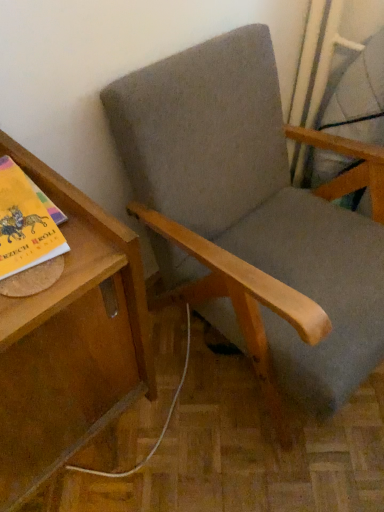
Question: From the image's perspective, is wooden table at left located above textured gray fabric chair at center?

Choices:
 (A) yes
 (B) no

Answer: (B)

Question: Is wooden table at left at the left side of textured gray fabric chair at center?

Choices:
 (A) no
 (B) yes

Answer: (B)

Question: Considering the relative sizes of wooden table at left and textured gray fabric chair at center in the image provided, is wooden table at left smaller than textured gray fabric chair at center?

Choices:
 (A) no
 (B) yes

Answer: (B)

Question: Can textured gray fabric chair at center be found inside wooden table at left?

Choices:
 (A) yes
 (B) no

Answer: (B)

Question: Does wooden table at left come in front of textured gray fabric chair at center?

Choices:
 (A) no
 (B) yes

Answer: (B)

Question: From a real-world perspective, is wooden table at left below textured gray fabric chair at center?

Choices:
 (A) yes
 (B) no

Answer: (A)

Question: Does matte gray swivel chair at upper right appear on the right side of textured gray fabric chair at center?

Choices:
 (A) no
 (B) yes

Answer: (B)

Question: Is matte gray swivel chair at upper right positioned behind textured gray fabric chair at center?

Choices:
 (A) yes
 (B) no

Answer: (A)

Question: Is matte gray swivel chair at upper right outside of textured gray fabric chair at center?

Choices:
 (A) yes
 (B) no

Answer: (A)

Question: From a real-world perspective, is matte gray swivel chair at upper right on top of textured gray fabric chair at center?

Choices:
 (A) yes
 (B) no

Answer: (A)

Question: Is matte gray swivel chair at upper right facing towards textured gray fabric chair at center?

Choices:
 (A) yes
 (B) no

Answer: (A)

Question: Is matte gray swivel chair at upper right taller than textured gray fabric chair at center?

Choices:
 (A) yes
 (B) no

Answer: (B)

Question: Is wooden table at left at the right side of matte gray swivel chair at upper right?

Choices:
 (A) no
 (B) yes

Answer: (A)